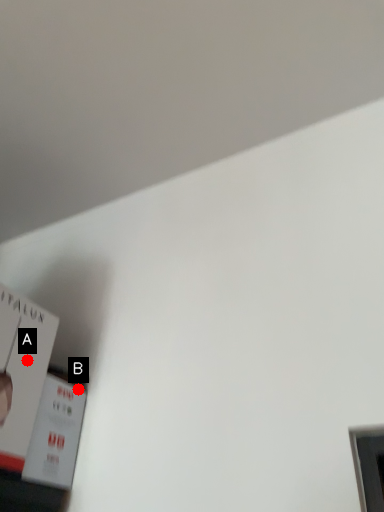
Question: Two points are circled on the image, labeled by A and B beside each circle. Which point is farther to the camera?

Choices:
 (A) A is further
 (B) B is further

Answer: (B)